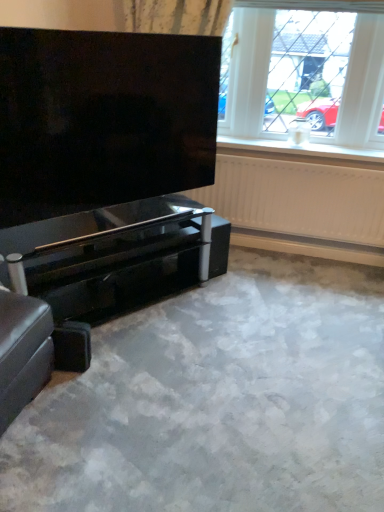
Question: Is white plastic window sill at upper center oriented away from leather ottoman at lower left?

Choices:
 (A) no
 (B) yes

Answer: (A)

Question: Considering the relative positions of white plastic window sill at upper center and leather ottoman at lower left in the image provided, is white plastic window sill at upper center to the left of leather ottoman at lower left from the viewer's perspective?

Choices:
 (A) yes
 (B) no

Answer: (B)

Question: Can you confirm if white plastic window sill at upper center is smaller than leather ottoman at lower left?

Choices:
 (A) yes
 (B) no

Answer: (A)

Question: From the image's perspective, does white plastic window sill at upper center appear higher than leather ottoman at lower left?

Choices:
 (A) no
 (B) yes

Answer: (B)

Question: Are white plastic window sill at upper center and leather ottoman at lower left far apart?

Choices:
 (A) yes
 (B) no

Answer: (A)

Question: From a real-world perspective, is white plastic window at upper center physically located above or below white textured radiator at upper right?

Choices:
 (A) above
 (B) below

Answer: (A)

Question: Considering the positions of white plastic window at upper center and white textured radiator at upper right in the image, is white plastic window at upper center wider or thinner than white textured radiator at upper right?

Choices:
 (A) thin
 (B) wide

Answer: (B)

Question: Does point (243, 58) appear closer or farther from the camera than point (336, 203)?

Choices:
 (A) farther
 (B) closer

Answer: (B)

Question: Would you say white plastic window at upper center is to the left or to the right of white textured radiator at upper right in the picture?

Choices:
 (A) right
 (B) left

Answer: (A)

Question: From the image's perspective, is leather ottoman at lower left located above or below white plastic window at upper center?

Choices:
 (A) above
 (B) below

Answer: (B)

Question: Would you say leather ottoman at lower left is to the left or to the right of white plastic window at upper center in the picture?

Choices:
 (A) right
 (B) left

Answer: (B)

Question: Is leather ottoman at lower left taller or shorter than white plastic window at upper center?

Choices:
 (A) short
 (B) tall

Answer: (A)

Question: Is leather ottoman at lower left wider or thinner than white plastic window at upper center?

Choices:
 (A) wide
 (B) thin

Answer: (A)

Question: Relative to satin fabric curtain at upper center, is glossy black piano at lower left in front or behind?

Choices:
 (A) behind
 (B) front

Answer: (B)

Question: Would you say glossy black piano at lower left is to the left or to the right of satin fabric curtain at upper center in the picture?

Choices:
 (A) right
 (B) left

Answer: (B)